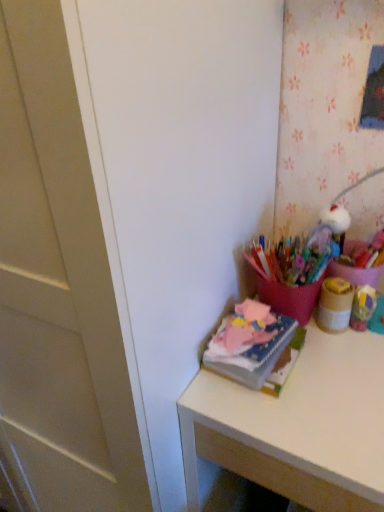
Question: Is matte brown jar at upper right turned away from soft pink fabric at upper right?

Choices:
 (A) no
 (B) yes

Answer: (A)

Question: Is matte brown jar at upper right positioned beyond the bounds of soft pink fabric at upper right?

Choices:
 (A) no
 (B) yes

Answer: (B)

Question: Can you see matte brown jar at upper right touching soft pink fabric at upper right?

Choices:
 (A) no
 (B) yes

Answer: (A)

Question: Is matte brown jar at upper right shorter than soft pink fabric at upper right?

Choices:
 (A) no
 (B) yes

Answer: (A)

Question: From a real-world perspective, is matte brown jar at upper right on top of soft pink fabric at upper right?

Choices:
 (A) yes
 (B) no

Answer: (A)

Question: From a real-world perspective, is matte brown jar at upper right above or below soft pink fabric at upper right?

Choices:
 (A) above
 (B) below

Answer: (A)

Question: Relative to soft pink fabric at upper right, is matte brown jar at upper right in front or behind?

Choices:
 (A) behind
 (B) front

Answer: (A)

Question: Does point (332, 309) appear closer or farther from the camera than point (251, 371)?

Choices:
 (A) closer
 (B) farther

Answer: (B)

Question: Is matte brown jar at upper right to the left or to the right of soft pink fabric at upper right in the image?

Choices:
 (A) left
 (B) right

Answer: (B)

Question: In the image, is soft pink fabric at upper right on the left side or the right side of matte brown jar at upper right?

Choices:
 (A) right
 (B) left

Answer: (B)

Question: Is soft pink fabric at upper right in front of or behind matte brown jar at upper right in the image?

Choices:
 (A) behind
 (B) front

Answer: (B)

Question: From the image's perspective, relative to matte brown jar at upper right, is soft pink fabric at upper right above or below?

Choices:
 (A) above
 (B) below

Answer: (B)

Question: Considering the positions of soft pink fabric at upper right and matte brown jar at upper right in the image, is soft pink fabric at upper right taller or shorter than matte brown jar at upper right?

Choices:
 (A) short
 (B) tall

Answer: (A)

Question: Considering their positions, is soft pink fabric at upper right located in front of or behind matte pink desk at right?

Choices:
 (A) behind
 (B) front

Answer: (A)

Question: In the image, is soft pink fabric at upper right on the left side or the right side of matte pink desk at right?

Choices:
 (A) left
 (B) right

Answer: (A)